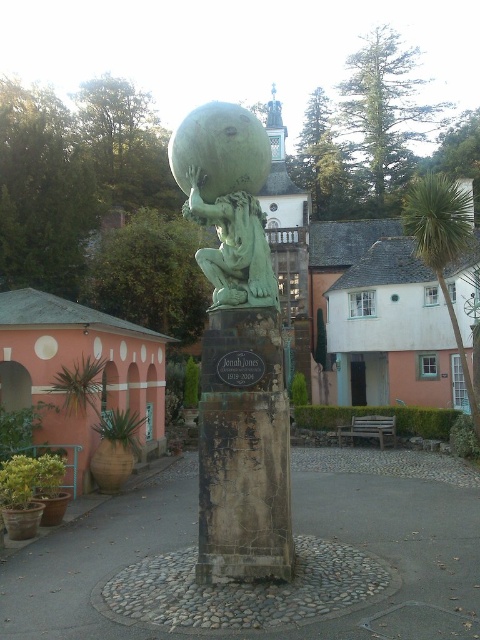
Question: Which object appears closest to the camera in this image?

Choices:
 (A) green leafy palm tree at upper right
 (B) green stone statue at center

Answer: (B)

Question: Does green stone statue at center have a greater width compared to green leafy palm tree at upper right?

Choices:
 (A) no
 (B) yes

Answer: (A)

Question: Which point is farther to the camera?

Choices:
 (A) (240, 257)
 (B) (462, 192)

Answer: (B)

Question: Is green stone statue at center smaller than green leafy palm tree at upper right?

Choices:
 (A) yes
 (B) no

Answer: (A)

Question: Among these points, which one is nearest to the camera?

Choices:
 (A) (415, 232)
 (B) (222, 300)

Answer: (B)

Question: Can you confirm if green stone statue at center is wider than green leafy palm tree at upper right?

Choices:
 (A) yes
 (B) no

Answer: (B)